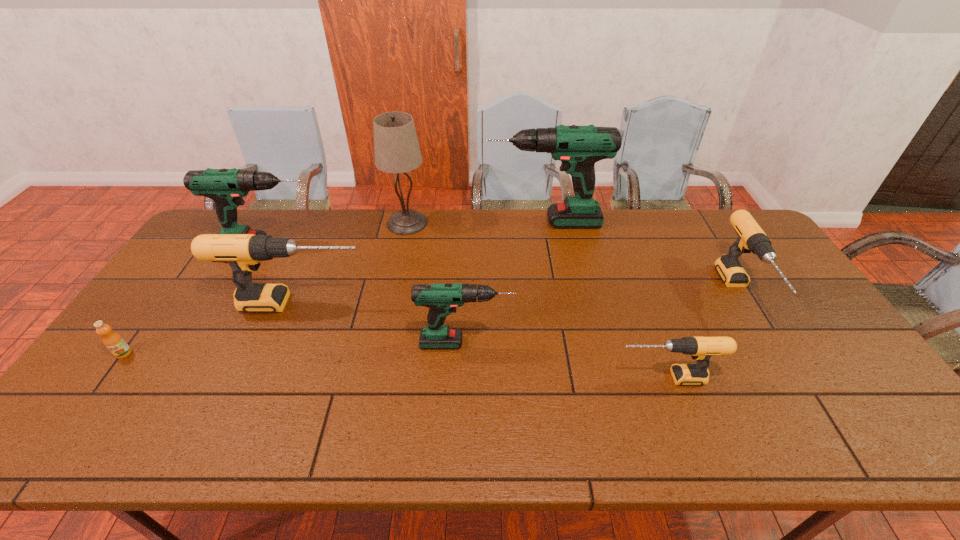
Locate an element on the screen. This screenshot has height=540, width=960. lampshade is located at coordinates (396, 147).

Identify the location of the tallest drill. (578, 148).

Find the location of `the farthest green drill`. the farthest green drill is located at coordinates (578, 148).

The width and height of the screenshot is (960, 540). Identify the location of the second nearest green drill. (226, 187).

Where is `the leftmost green drill`? the leftmost green drill is located at coordinates (226, 187).

Identify the location of the biggest black drill. The width and height of the screenshot is (960, 540). (242, 252).

This screenshot has height=540, width=960. Identify the location of the nearest green drill. (442, 299).

Where is `the rightmost object`? The height and width of the screenshot is (540, 960). the rightmost object is located at coordinates (751, 238).

Locate an element on the screen. the rightmost black drill is located at coordinates (751, 238).

Identify the location of the second shortest object. The image size is (960, 540). (701, 349).